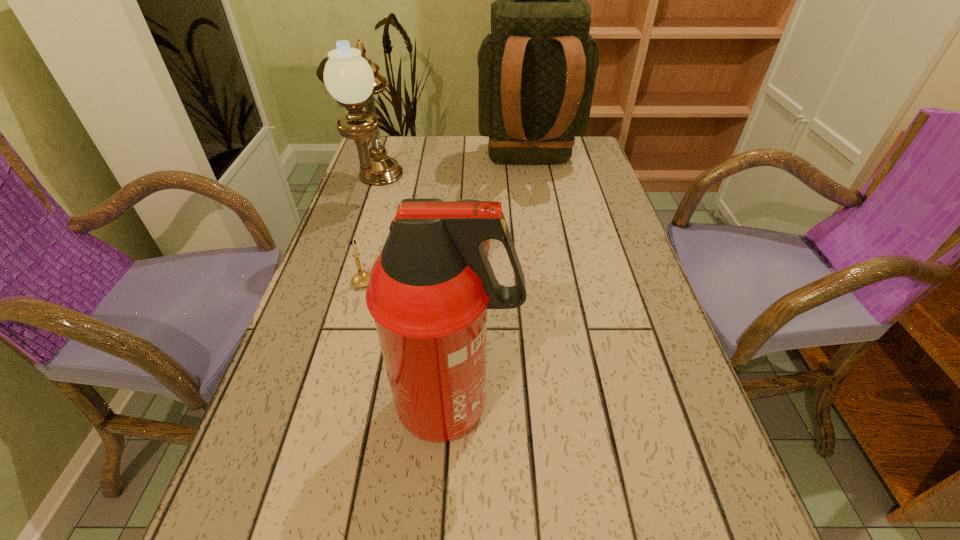
The image size is (960, 540). Identify the location of free spot located on the side of the third farthest object with the handle. (471, 171).

Image resolution: width=960 pixels, height=540 pixels. Find the location of `vacant space located 0.180m on the handle side of the second nearest object`. vacant space located 0.180m on the handle side of the second nearest object is located at coordinates (379, 224).

Find the location of a particular element. This screenshot has height=540, width=960. vacant area situated on the handle side of the second nearest object is located at coordinates (387, 197).

Where is `blank space located 0.390m on the handle side of the second nearest object`? blank space located 0.390m on the handle side of the second nearest object is located at coordinates (391, 181).

Identify the location of backpack present at the far edge. This screenshot has height=540, width=960. (537, 69).

Where is `oil lamp that is at the far edge`? This screenshot has width=960, height=540. oil lamp that is at the far edge is located at coordinates (352, 79).

Image resolution: width=960 pixels, height=540 pixels. I want to click on oil lamp that is at the left edge, so click(352, 79).

In order to click on candle holder located in the left edge section of the desktop in this screenshot , I will do `click(361, 279)`.

Identify the location of object located in the right edge section of the desktop. The width and height of the screenshot is (960, 540). click(x=537, y=69).

Where is `object present at the far left corner`? Image resolution: width=960 pixels, height=540 pixels. object present at the far left corner is located at coordinates (352, 79).